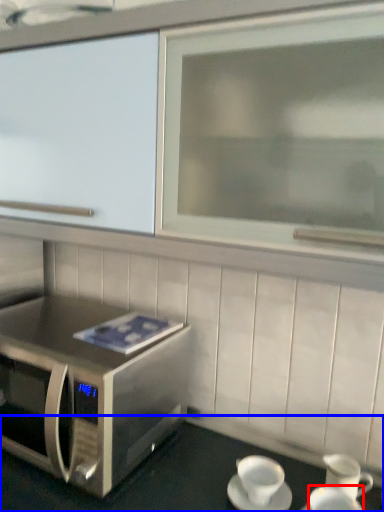
Question: Which object is closer to the camera taking this photo, coffee cup (highlighted by a red box) or table (highlighted by a blue box)?

Choices:
 (A) coffee cup
 (B) table

Answer: (B)